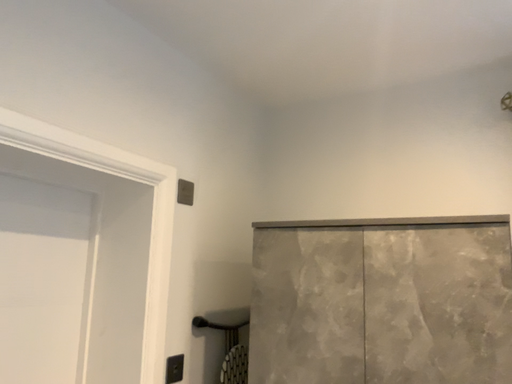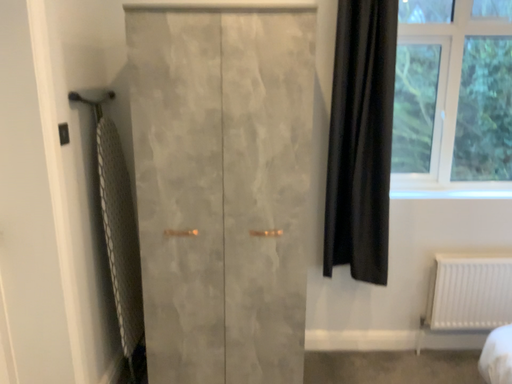
Question: Which way did the camera rotate in the video?

Choices:
 (A) rotated upward
 (B) rotated downward

Answer: (B)